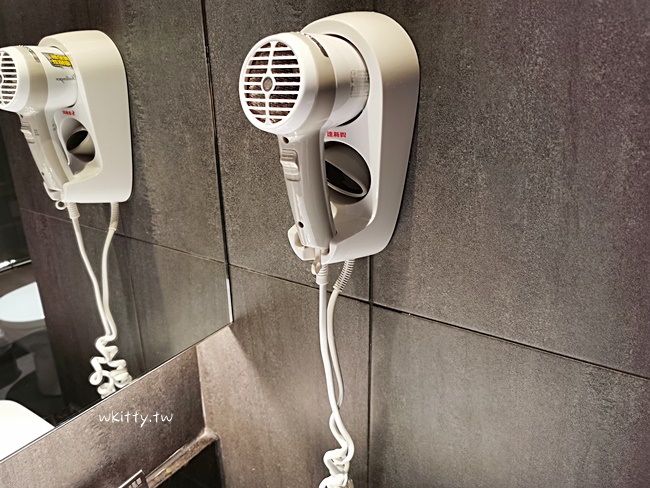
Identify the location of mirror. Image resolution: width=650 pixels, height=488 pixels. (70, 392).